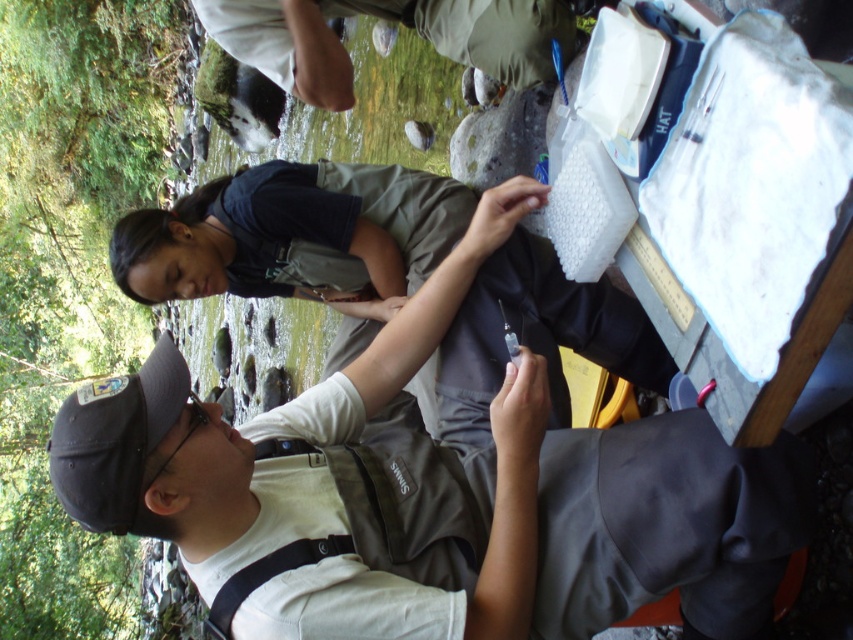
Question: Observing the image, what is the correct spatial positioning of dark gray uniform at center in reference to light beige fabric pants at upper center?

Choices:
 (A) left
 (B) right

Answer: (A)

Question: Does dark gray uniform at center have a larger size compared to light beige fabric pants at upper center?

Choices:
 (A) no
 (B) yes

Answer: (B)

Question: Can you confirm if matte gray vest at center is bigger than dark gray uniform at center?

Choices:
 (A) yes
 (B) no

Answer: (A)

Question: Which object appears closest to the camera in this image?

Choices:
 (A) matte gray vest at center
 (B) dark gray uniform at center

Answer: (A)

Question: Which object is farther from the camera taking this photo?

Choices:
 (A) matte gray vest at center
 (B) dark gray uniform at center

Answer: (B)

Question: Which point is closer to the camera?

Choices:
 (A) (409, 186)
 (B) (257, 67)
 (C) (654, 561)

Answer: (C)